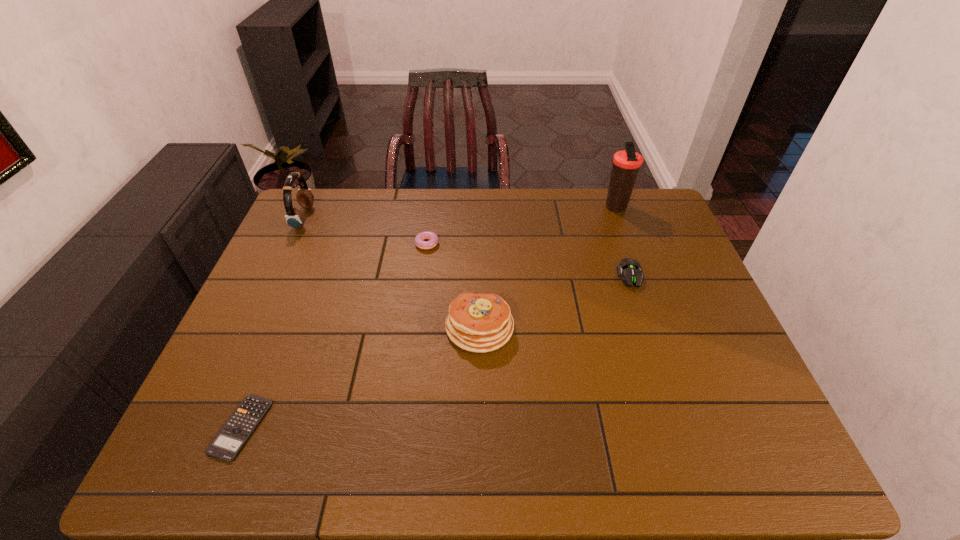
At what (x,y) coordinates should I click in order to perform the action: click on thermos bottle positioned at the right edge. Please return your answer as a coordinate pair (x, y). The width and height of the screenshot is (960, 540). Looking at the image, I should click on (626, 164).

Where is `computer mouse that is positioned at the right edge`? The width and height of the screenshot is (960, 540). computer mouse that is positioned at the right edge is located at coordinates (630, 270).

Locate an element on the screen. The height and width of the screenshot is (540, 960). object located at the far left corner is located at coordinates (294, 217).

This screenshot has height=540, width=960. What are the coordinates of `object that is positioned at the near left corner` in the screenshot? It's located at [227, 444].

Find the location of `object present at the far right corner`. object present at the far right corner is located at coordinates (626, 164).

Locate an element on the screen. This screenshot has height=540, width=960. vacant position at the far edge of the desktop is located at coordinates (420, 231).

Find the location of `vacant space at the near edge`. vacant space at the near edge is located at coordinates coord(338,447).

In order to click on vacant space at the left edge of the desktop in this screenshot , I will do `click(294, 336)`.

In the image, there is a desktop. Find the location of `vacant region at the right edge`. vacant region at the right edge is located at coordinates (655, 275).

Image resolution: width=960 pixels, height=540 pixels. I want to click on free spot between the shortest object and the headset, so click(x=273, y=322).